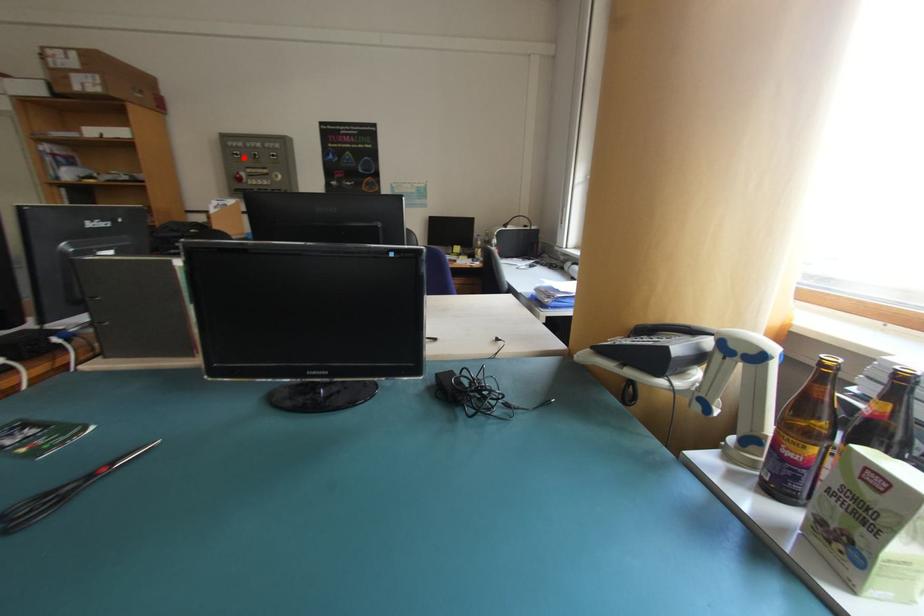
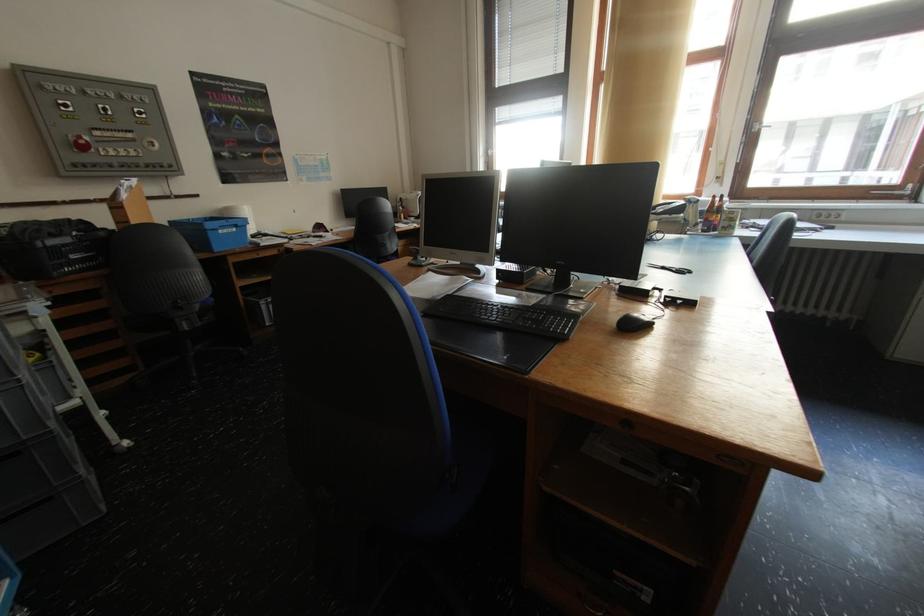
The point at the highlighted location is marked in the first image. Where is the corresponding point in the second image?

(71, 110)